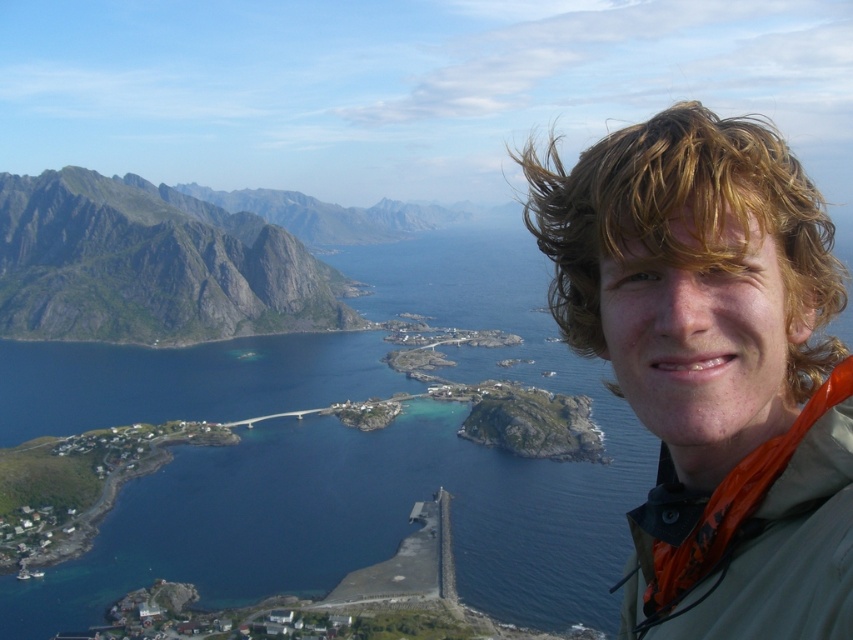
You are a photographer planning to capture a wide landscape shot of the blue water at center and the gray rocky mountain at left. Based on their widths, which one should you prioritize framing first to ensure both fit in the shot?

The blue water at center has a greater width than the gray rocky mountain at left. To ensure both fit in the shot, prioritize framing the blue water at center first since it occupies more space.